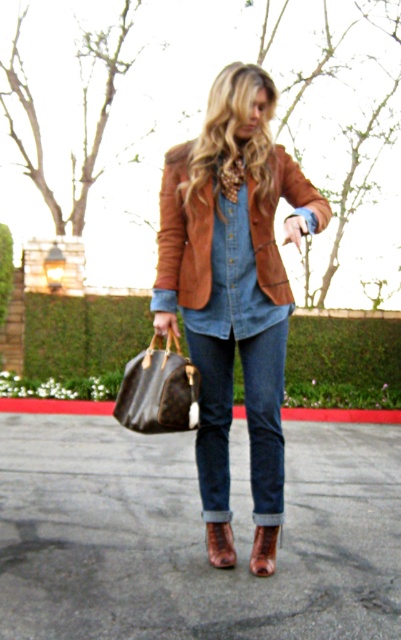
Question: Which of these objects is positioned farthest from the brown leather handbag at lower left?

Choices:
 (A) brown leather boot at lower center
 (B) suede brown blazer at center

Answer: (A)

Question: Which of the following is the closest to the observer?

Choices:
 (A) (271, 196)
 (B) (224, 560)
 (C) (141, 376)
 (D) (263, 547)

Answer: (A)

Question: Which of the following is the farthest from the observer?

Choices:
 (A) (267, 540)
 (B) (216, 292)
 (C) (139, 424)
 (D) (210, 544)

Answer: (D)

Question: Can you confirm if brown leather jacket at center is positioned above brown leather boot at lower center?

Choices:
 (A) no
 (B) yes

Answer: (B)

Question: Can you confirm if suede brown blazer at center is positioned to the left of brown leather handbag at lower left?

Choices:
 (A) no
 (B) yes

Answer: (A)

Question: Can you confirm if denim jeans at center is positioned below leather boot at lower center?

Choices:
 (A) no
 (B) yes

Answer: (A)